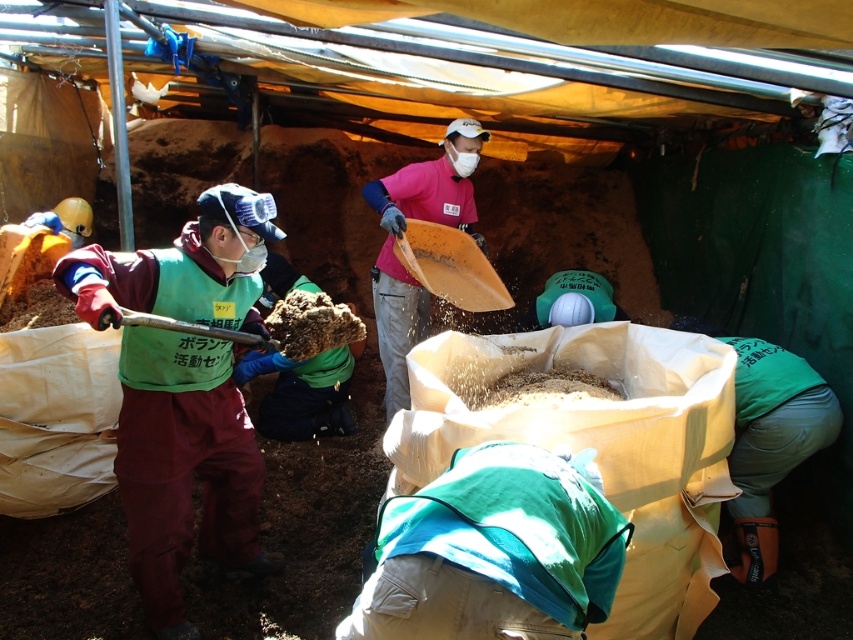
Is green fabric bag at lower right wider than brushed metal shovel at left?

Yes, green fabric bag at lower right is wider than brushed metal shovel at left.

Who is more forward, [840,413] or [160,316]?

Positioned in front is point [160,316].

Image resolution: width=853 pixels, height=640 pixels. What are the coordinates of `green fabric bag at lower right` in the screenshot? It's located at (769, 436).

Between point (735, 445) and point (402, 257), which one is positioned behind?

Positioned behind is point (402, 257).

From the picture: Can you confirm if green fabric bag at lower right is wider than wooden shovel at center?

Incorrect, green fabric bag at lower right's width does not surpass wooden shovel at center's.

The height and width of the screenshot is (640, 853). Identify the location of green fabric bag at lower right. (769, 436).

This screenshot has height=640, width=853. In order to click on green fabric bag at lower right in this screenshot , I will do `click(769, 436)`.

Is wooden shovel at center thinner than brushed metal shovel at left?

No, wooden shovel at center is not thinner than brushed metal shovel at left.

Who is more distant from viewer, (416, 237) or (137, 321)?

Positioned behind is point (416, 237).

Locate an element on the screen. The width and height of the screenshot is (853, 640). wooden shovel at center is located at coordinates (450, 266).

At what (x,y) coordinates should I click in order to perform the action: click on wooden shovel at center. Please return your answer as a coordinate pair (x, y). Image resolution: width=853 pixels, height=640 pixels. Looking at the image, I should click on (450, 266).